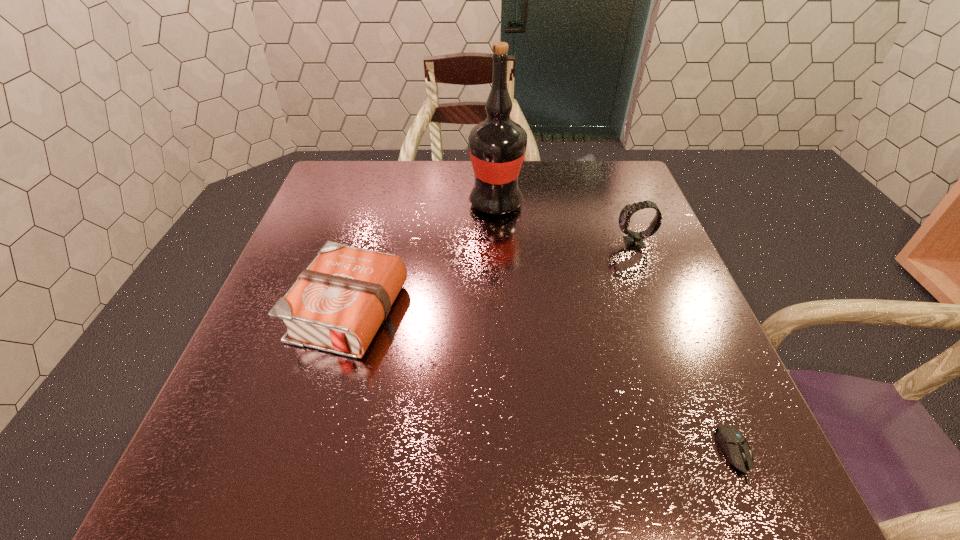
The image size is (960, 540). In order to click on free space that satisfies the following two spatial constraints: 1. on the front side of the farthest object; 2. on the right side of the shortest object in this screenshot , I will do `click(507, 454)`.